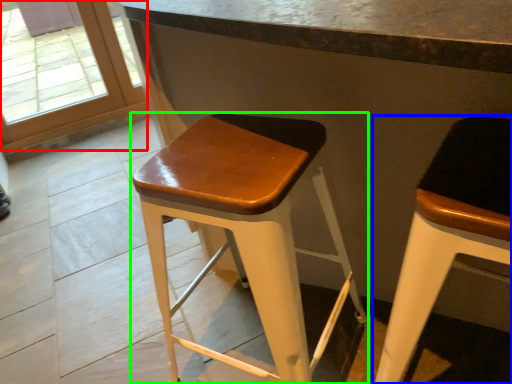
Question: Based on their relative distances, which object is farther from glass door (highlighted by a red box)? Choose from stool (highlighted by a blue box) and stool (highlighted by a green box).

Choices:
 (A) stool
 (B) stool

Answer: (A)